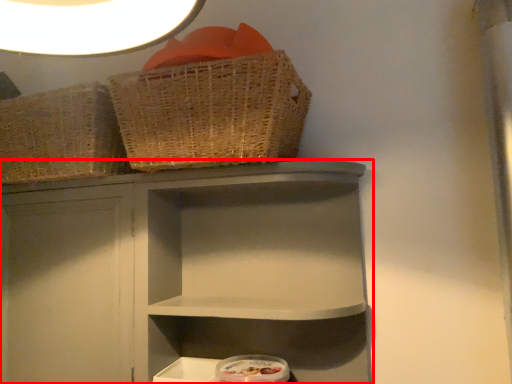
Question: Considering the relative positions of shelf (annotated by the red box) and basket in the image provided, where is shelf (annotated by the red box) located with respect to the staircase?

Choices:
 (A) right
 (B) left

Answer: (A)